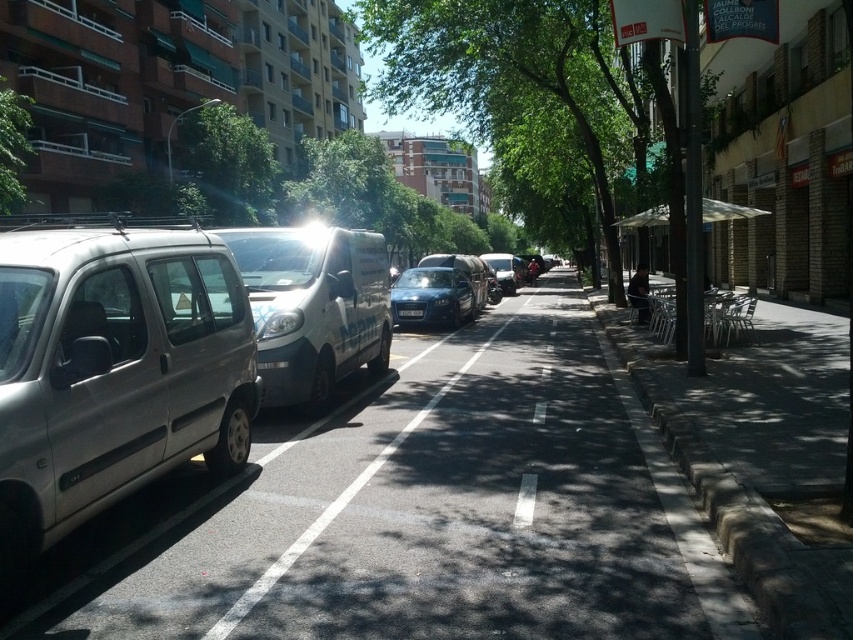
Question: Which of the following is the closest to the observer?

Choices:
 (A) green leafy tree at upper left
 (B) silver metallic van at left

Answer: (B)

Question: Which point is closer to the camera?

Choices:
 (A) white glossy van at center
 (B) green leafy tree at center
 (C) matte blue car at center
 (D) white matte van at left

Answer: (A)

Question: Does green leafy tree at upper center appear over green leafy tree at upper left?

Choices:
 (A) yes
 (B) no

Answer: (A)

Question: Is silver metallic van at left to the right of green leafy tree at center from the viewer's perspective?

Choices:
 (A) yes
 (B) no

Answer: (B)

Question: Does silver metallic van at left come behind matte blue car at center?

Choices:
 (A) yes
 (B) no

Answer: (B)

Question: Estimate the real-world distances between objects in this image. Which object is closer to the matte blue car at center?

Choices:
 (A) silver metallic van at left
 (B) green leafy tree at upper center

Answer: (A)